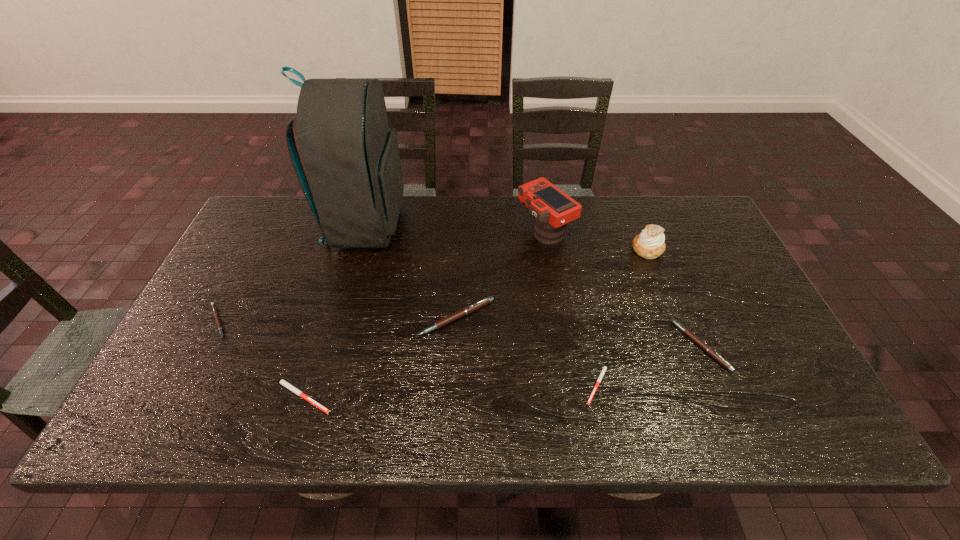
The height and width of the screenshot is (540, 960). I want to click on backpack, so click(351, 157).

Find the location of a particular element. Image resolution: width=960 pixels, height=540 pixels. gray backpack is located at coordinates (351, 157).

The height and width of the screenshot is (540, 960). I want to click on camera, so click(552, 208).

At what (x,y) coordinates should I click in order to perform the action: click on pastry. Please return your answer as a coordinate pair (x, y). This screenshot has height=540, width=960. Looking at the image, I should click on (649, 244).

Where is `the fifth object from right to left`? The image size is (960, 540). the fifth object from right to left is located at coordinates (477, 305).

At what (x,y) coordinates should I click in order to perform the action: click on the second pink pen from right to left. Please return your answer as a coordinate pair (x, y). Image resolution: width=960 pixels, height=540 pixels. Looking at the image, I should click on (477, 305).

Find the location of a particular element. The width and height of the screenshot is (960, 540). the second biggest pink pen is located at coordinates (709, 350).

Where is `the rightmost pen`? This screenshot has width=960, height=540. the rightmost pen is located at coordinates (709, 350).

Where is `the leftmost pen`? The image size is (960, 540). the leftmost pen is located at coordinates (215, 313).

Find the location of a particular element. This screenshot has height=540, width=960. the leftmost object is located at coordinates (215, 313).